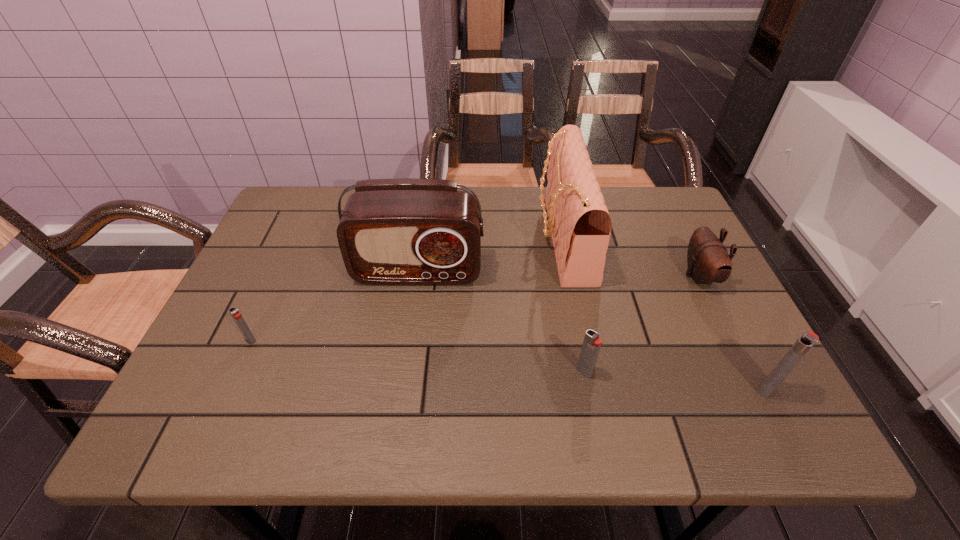
This screenshot has height=540, width=960. Find the location of `blank region between the leftmost igniter and the second igniter from right to left`. blank region between the leftmost igniter and the second igniter from right to left is located at coordinates (418, 356).

Where is `vacant point located between the pouch and the fifth farthest object`? The image size is (960, 540). vacant point located between the pouch and the fifth farthest object is located at coordinates (642, 324).

Identify the location of free spot between the handbag and the fifth object from right to left. The width and height of the screenshot is (960, 540). (491, 255).

Find the location of a particular element. Image resolution: width=960 pixels, height=540 pixels. unoccupied area between the second farthest igniter and the leftmost igniter is located at coordinates (418, 356).

What are the coordinates of `free spot between the second nearest object and the shortest object` in the screenshot? It's located at (418, 356).

Identify the location of vacant space that's between the rightmost igniter and the pouch. (733, 333).

At what (x,y) coordinates should I click in order to perform the action: click on free area in between the shortest object and the pouch. Please return your answer as a coordinate pair (x, y). Image resolution: width=960 pixels, height=540 pixels. Looking at the image, I should click on (475, 308).

Where is `object identified as the closest to the second tallest igniter`? object identified as the closest to the second tallest igniter is located at coordinates (579, 222).

Choose which object is the nearest neighbor to the third tallest object. Please provide its 2D coordinates. Your answer should be formatted as a tuple, i.e. [(x, y)], where the tuple contains the x and y coordinates of a point satisfying the conditions above.

[(708, 260)]

Identify the location of the third closest igniter relative to the pouch. (234, 312).